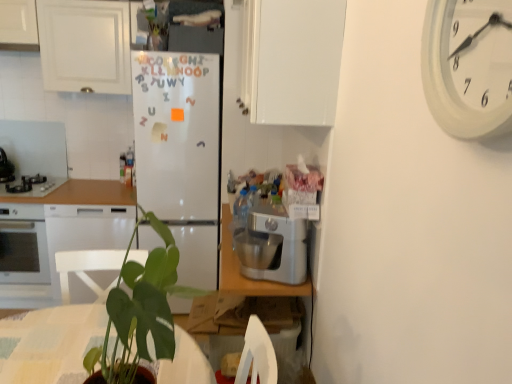
Question: Can you confirm if white matte refrigerator at center is smaller than white glossy cabinet at upper left, which is the 2th cabinetry in front-to-back order?

Choices:
 (A) no
 (B) yes

Answer: (A)

Question: Is white matte refrigerator at center placed right next to white glossy cabinet at upper left, the first cabinetry when ordered from back to front?

Choices:
 (A) no
 (B) yes

Answer: (A)

Question: Is the position of white matte refrigerator at center more distant than that of white glossy cabinet at upper left, the first cabinetry when ordered from back to front?

Choices:
 (A) yes
 (B) no

Answer: (B)

Question: Would you say white matte refrigerator at center contains white glossy cabinet at upper left, acting as the 1th cabinetry starting from the left?

Choices:
 (A) yes
 (B) no

Answer: (B)

Question: Is white matte refrigerator at center positioned in front of white glossy cabinet at upper left, the first cabinetry when ordered from back to front?

Choices:
 (A) yes
 (B) no

Answer: (A)

Question: Considering their positions, is wooden countertop at left located in front of or behind white plastic clock at upper right?

Choices:
 (A) behind
 (B) front

Answer: (A)

Question: Does point (130, 193) appear closer or farther from the camera than point (510, 87)?

Choices:
 (A) farther
 (B) closer

Answer: (A)

Question: Is wooden countertop at left wider or thinner than white plastic clock at upper right?

Choices:
 (A) thin
 (B) wide

Answer: (B)

Question: Based on their positions, is wooden countertop at left located to the left or right of white plastic clock at upper right?

Choices:
 (A) right
 (B) left

Answer: (B)

Question: From the image's perspective, is white plastic clock at upper right positioned above or below black glass cooktop at left, arranged as the 1th appliance when ordered from the bottom?

Choices:
 (A) above
 (B) below

Answer: (A)

Question: Considering the positions of white plastic clock at upper right and black glass cooktop at left, the second appliance in the top-to-bottom sequence, in the image, is white plastic clock at upper right bigger or smaller than black glass cooktop at left, the second appliance in the top-to-bottom sequence,?

Choices:
 (A) big
 (B) small

Answer: (B)

Question: Considering the positions of white plastic clock at upper right and black glass cooktop at left, arranged as the 1th appliance when ordered from the bottom, in the image, is white plastic clock at upper right wider or thinner than black glass cooktop at left, arranged as the 1th appliance when ordered from the bottom,?

Choices:
 (A) thin
 (B) wide

Answer: (A)

Question: From a real-world perspective, is white plastic clock at upper right positioned above or below black glass cooktop at left, arranged as the 1th appliance when ordered from the bottom?

Choices:
 (A) below
 (B) above

Answer: (B)

Question: Would you say brushed metal stove at left, the first appliance when ordered from top to bottom, is to the left or to the right of silver metallic stand mixer at center in the picture?

Choices:
 (A) left
 (B) right

Answer: (A)

Question: From a real-world perspective, is brushed metal stove at left, the first appliance when ordered from top to bottom, above or below silver metallic stand mixer at center?

Choices:
 (A) above
 (B) below

Answer: (B)